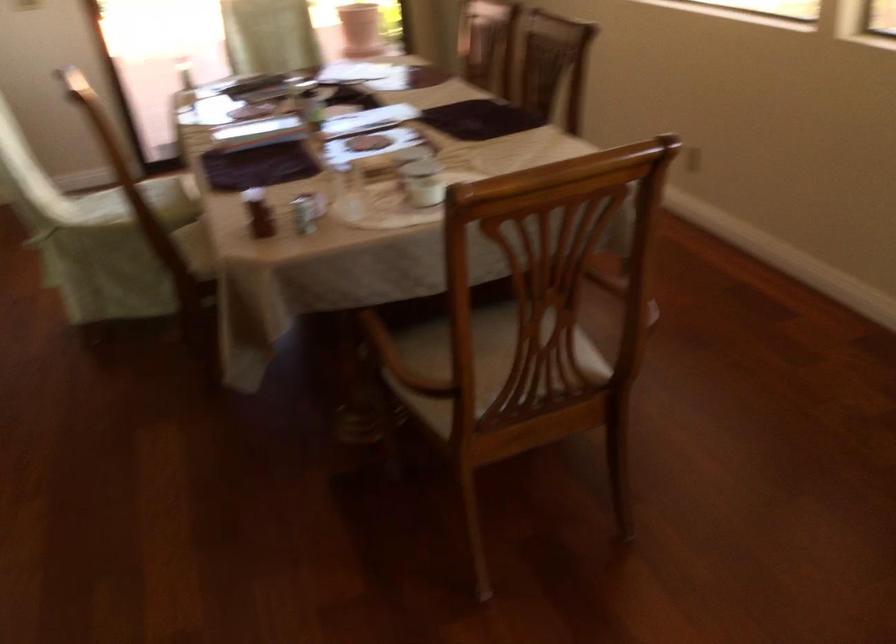
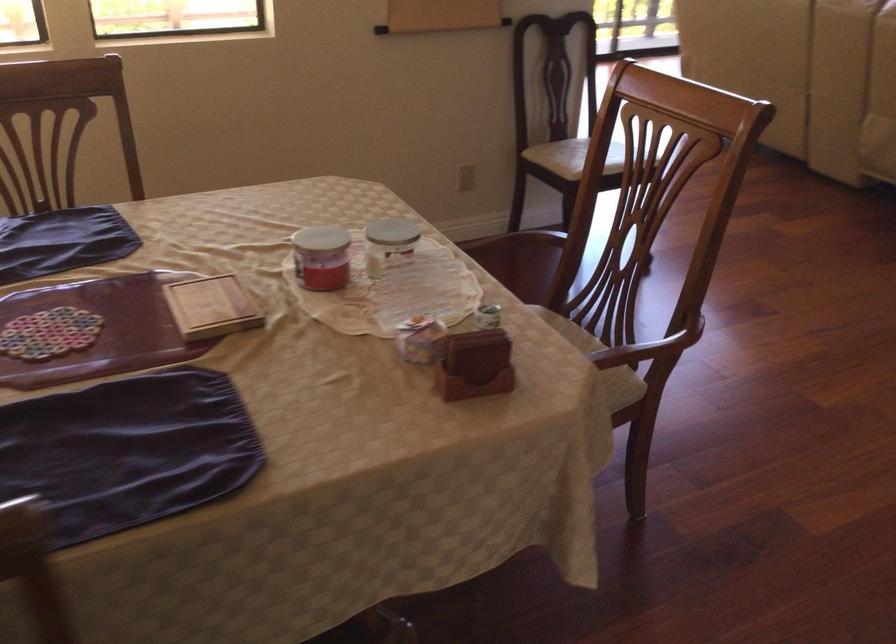
Locate, in the second image, the point that corresponds to [401,172] in the first image.

(389, 243)